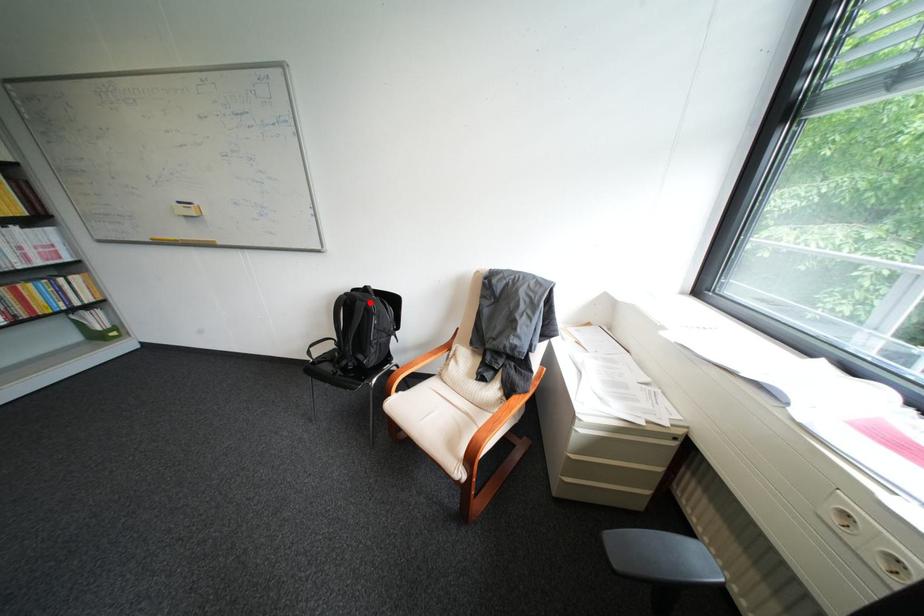
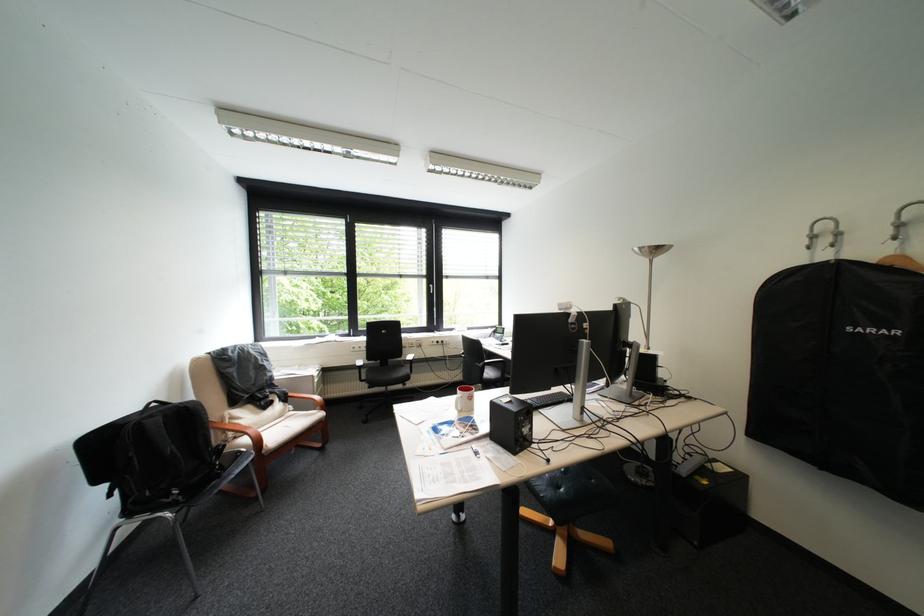
Find the pixel in the second image that matches the highlighted location in the first image.

(199, 407)